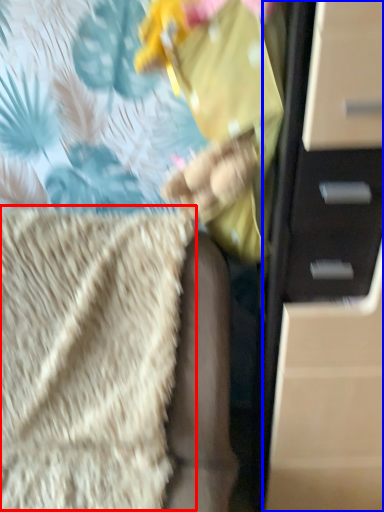
Question: Which object appears farthest to the camera in this image, blanket (highlighted by a red box) or chest of drawers (highlighted by a blue box)?

Choices:
 (A) blanket
 (B) chest of drawers

Answer: (B)